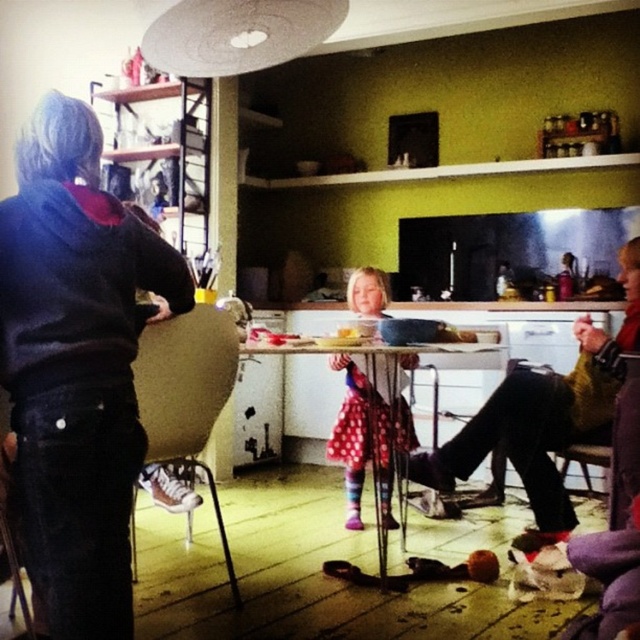
You are a guest in this kitchen and need to sit down. There is a polka dot dress at center and a wooden chair at right. Which object should you approach to find a place to sit?

You should approach the wooden chair at right to sit down because chairs are designed for sitting, while the polka dot dress at center is clothing and not meant for sitting.

You are planning to place a large potted plant between the brown fabric chair at lower left and the wooden chair at right. Considering their widths, which chair should the plant be closer to?

The brown fabric chair at lower left has a larger width than the wooden chair at right, so the plant should be placed closer to the brown fabric chair at lower left to maintain balance between the two chairs.